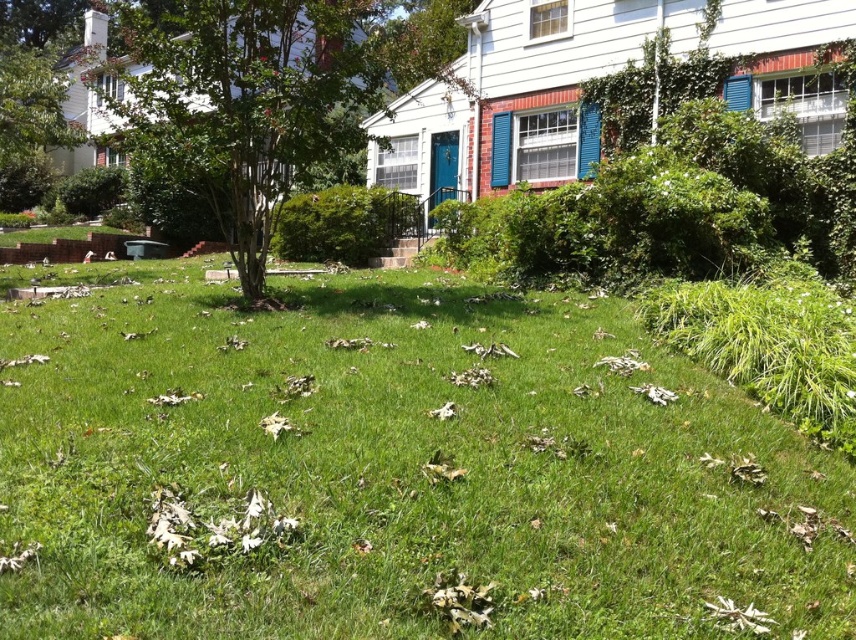
Question: Which point is closer to the camera taking this photo?

Choices:
 (A) (300, 140)
 (B) (634, 497)

Answer: (B)

Question: Does green grass at center come in front of green leafy tree at center?

Choices:
 (A) no
 (B) yes

Answer: (B)

Question: Does green grass at center have a greater width compared to green leafy tree at center?

Choices:
 (A) yes
 (B) no

Answer: (B)

Question: Is green grass at center positioned at the back of green leafy tree at center?

Choices:
 (A) no
 (B) yes

Answer: (A)

Question: Which point appears closest to the camera in this image?

Choices:
 (A) (241, 243)
 (B) (495, 561)

Answer: (B)